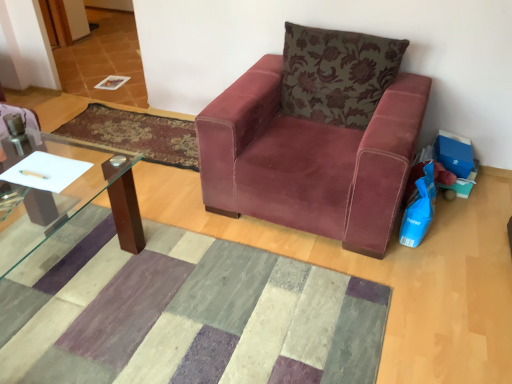
At what (x,y) coordinates should I click in order to perform the action: click on vacant area situated to the left side of velvet maroon armchair at center. Please return your answer as a coordinate pair (x, y). This screenshot has width=512, height=384. Looking at the image, I should click on (147, 197).